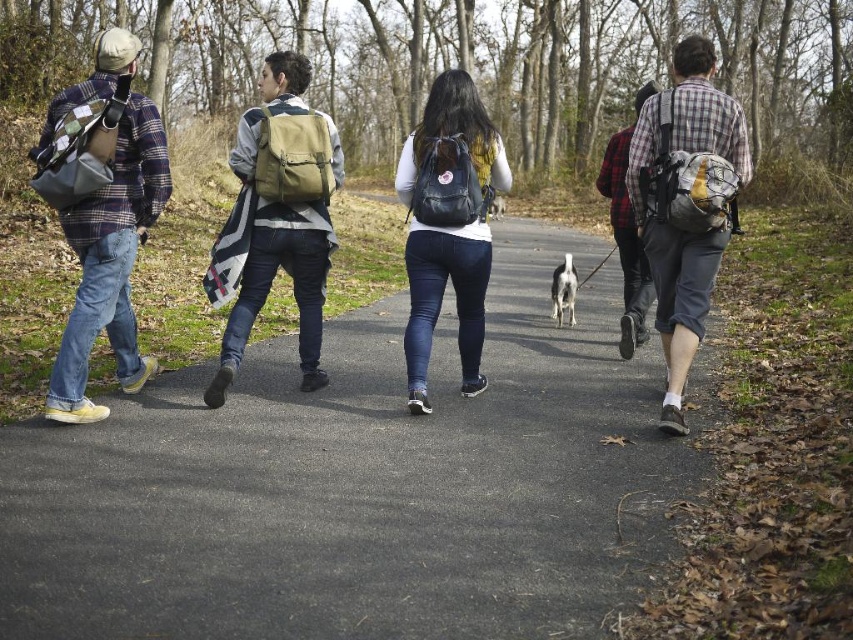
You are planning to take a photo of the group while standing at the point indicated by coordinates point (448, 225). What object will be directly in front of you?

The point (448, 225) indicates the black matte backpack at center, so the black matte backpack at center will be directly in front of you.